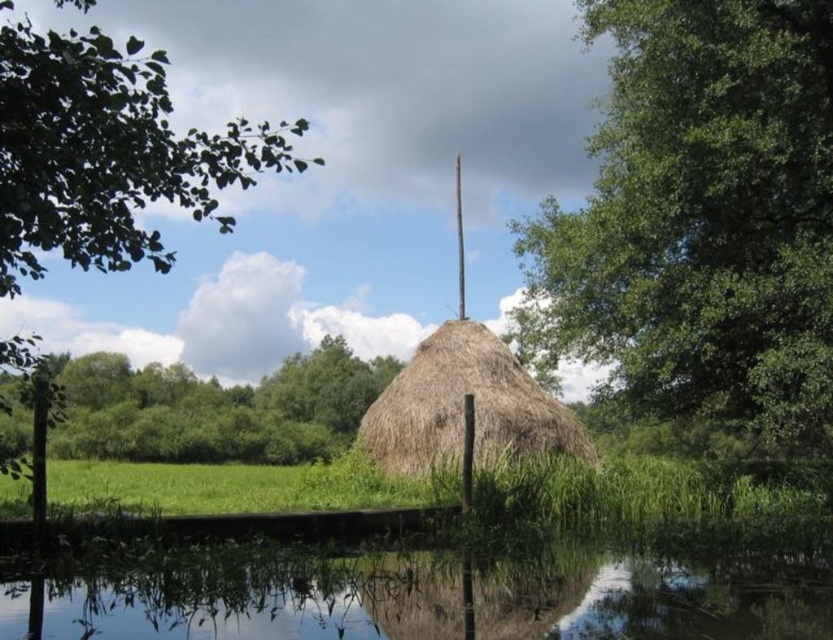
Question: Can you confirm if green grassy field at center is positioned to the left of green leafy tree at left?

Choices:
 (A) no
 (B) yes

Answer: (A)

Question: Is green leafy tree at upper right to the left of brown thatch hut at center from the viewer's perspective?

Choices:
 (A) no
 (B) yes

Answer: (A)

Question: Based on their relative distances, which object is nearer to the green leafy tree at left?

Choices:
 (A) transparent water at lower center
 (B) green grassy field at center

Answer: (B)

Question: Which point is closer to the camera?

Choices:
 (A) (370, 632)
 (B) (95, 488)
 (C) (517, 392)

Answer: (A)

Question: Is green grassy field at center smaller than green leafy tree at left?

Choices:
 (A) yes
 (B) no

Answer: (A)

Question: Which of the following is the farthest from the observer?

Choices:
 (A) (686, 196)
 (B) (252, 483)

Answer: (B)